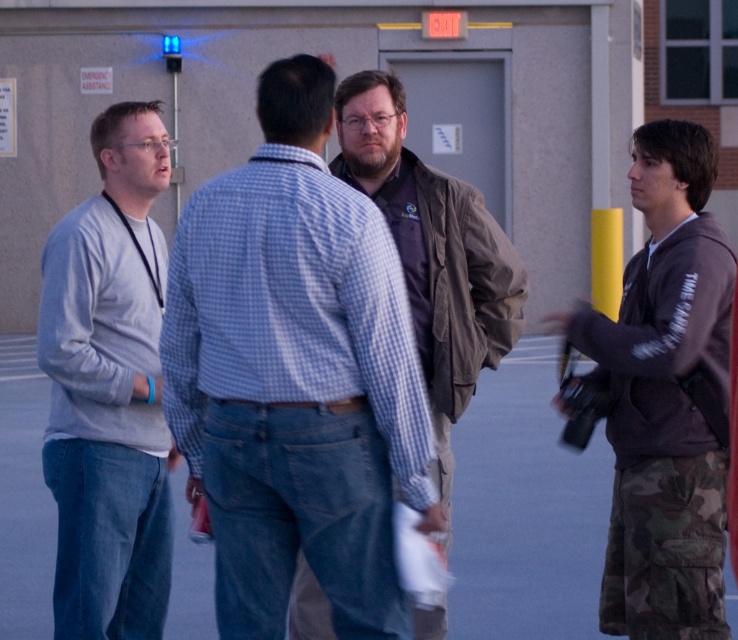
Question: Among these points, which one is nearest to the camera?

Choices:
 (A) (159, 572)
 (B) (324, 513)
 (C) (410, 224)
 (D) (652, 513)

Answer: (B)

Question: Is camouflage pants at right smaller than light gray sweater at left?

Choices:
 (A) yes
 (B) no

Answer: (B)

Question: Estimate the real-world distances between objects in this image. Which object is farther from the brown fabric jacket at center?

Choices:
 (A) camouflage pants at right
 (B) blue checkered shirt at center

Answer: (B)

Question: Can you confirm if blue checkered shirt at center is thinner than camouflage pants at right?

Choices:
 (A) no
 (B) yes

Answer: (A)

Question: Which point is farther from the camera taking this photo?

Choices:
 (A) (331, 516)
 (B) (714, 516)

Answer: (B)

Question: Does camouflage pants at right have a smaller size compared to light gray sweater at left?

Choices:
 (A) no
 (B) yes

Answer: (A)